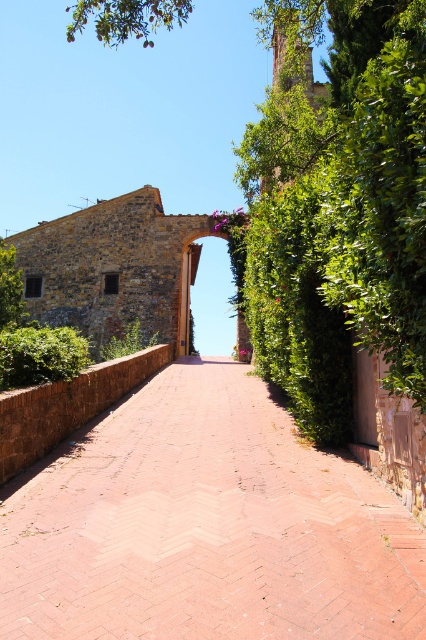
You are standing at the entrance of the rustic stone building and want to walk through the stone archway at center. Which direction should you move relative to the brick paved path at center to reach the archway?

The brick paved path at center is positioned on the left side of the stone archway at center, so you should move to the right relative to the brick paved path at center to reach the archway.

You are an artist planning to paint the scene. You want to ensure the green leafy tree at center and the stone archway at center are proportionally accurate. Which object should you make wider in your painting?

The green leafy tree at center should be made wider in the painting since its width is larger than the stone archway at center.